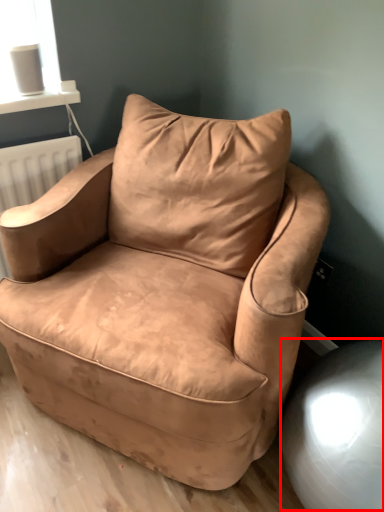
Question: From the image's perspective, where is swivel chair (annotated by the red box) located in relation to chair in the image?

Choices:
 (A) below
 (B) above

Answer: (A)